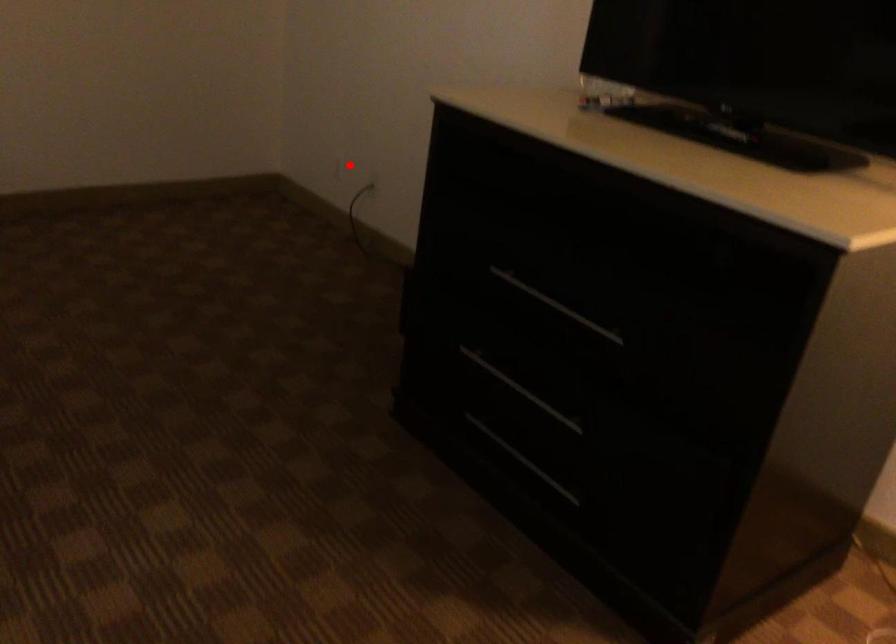
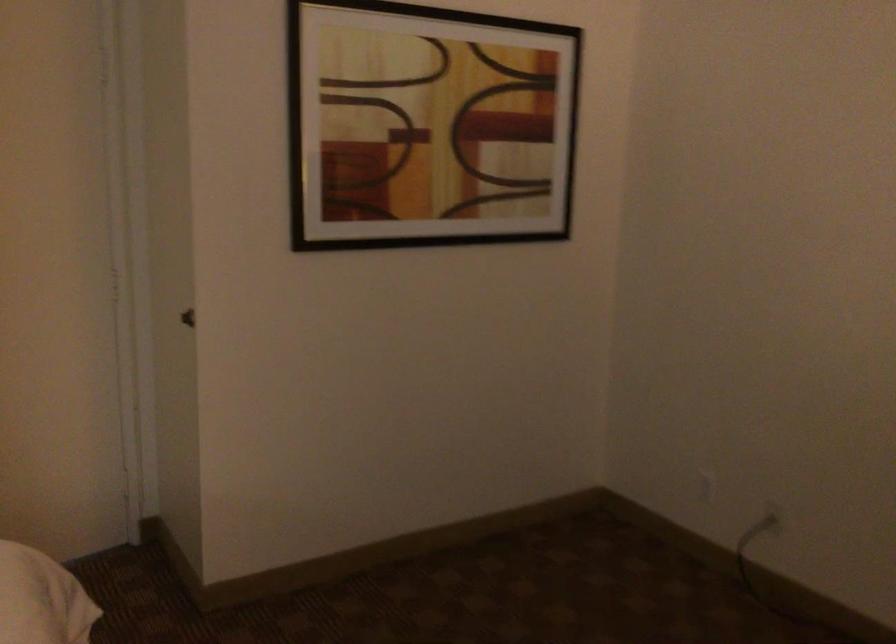
The point at the highlighted location is marked in the first image. Where is the corresponding point in the second image?

(707, 487)